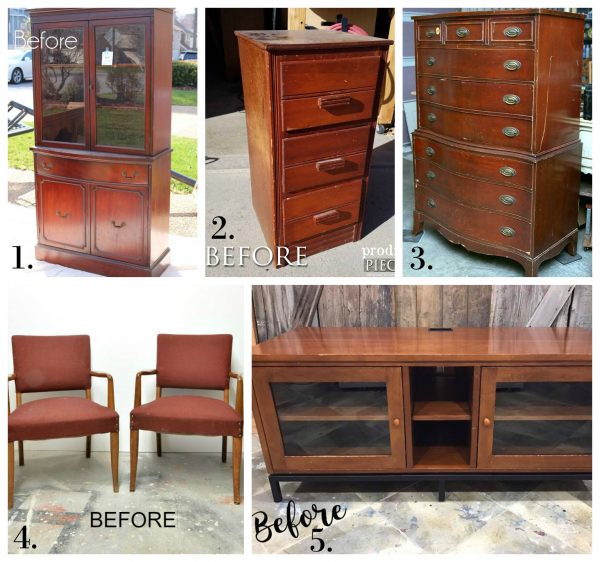
The width and height of the screenshot is (600, 562). In order to click on two small brown old chairs in this screenshot , I will do `click(91, 430)`.